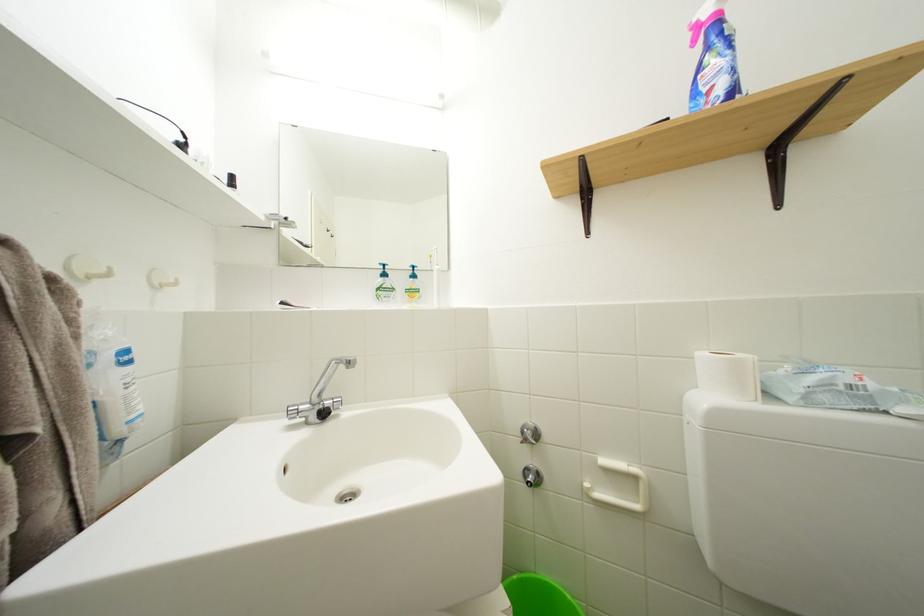
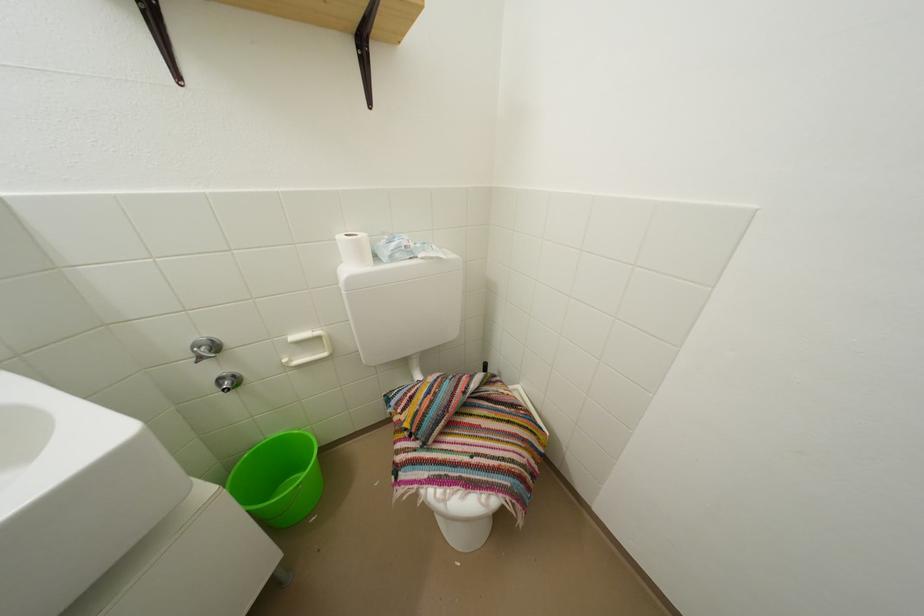
Locate, in the second image, the point that corresponds to pixel 538 438 in the first image.

(213, 354)